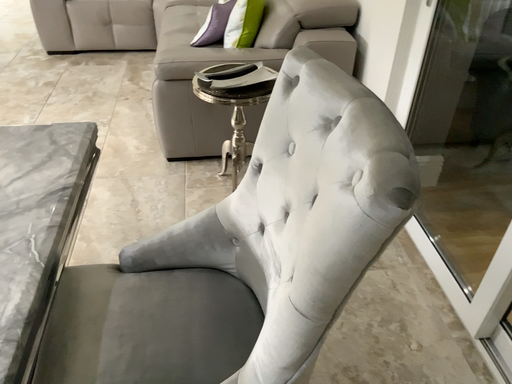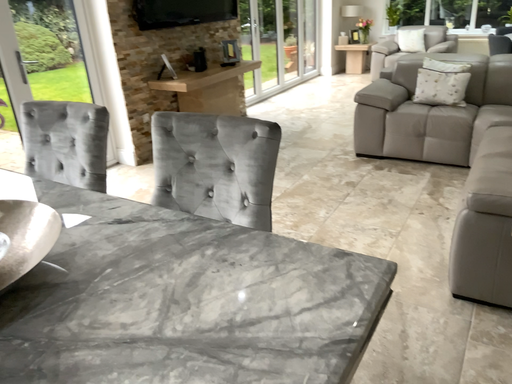
Question: How did the camera likely rotate when shooting the video?

Choices:
 (A) rotated downward
 (B) rotated upward

Answer: (B)